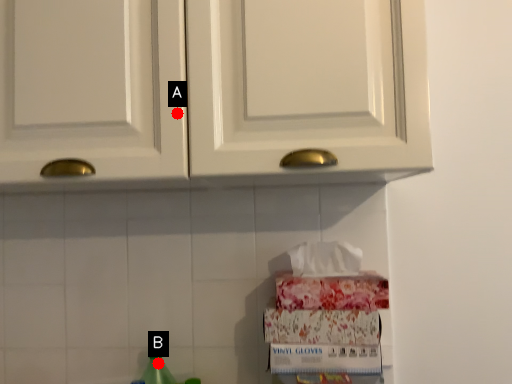
Question: Two points are circled on the image, labeled by A and B beside each circle. Which point is closer to the camera taking this photo?

Choices:
 (A) A is closer
 (B) B is closer

Answer: (A)